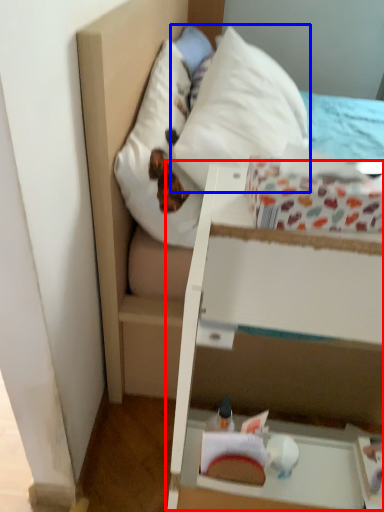
Question: Among these objects, which one is nearest to the camera, vanity (highlighted by a red box) or pillow (highlighted by a blue box)?

Choices:
 (A) vanity
 (B) pillow

Answer: (A)